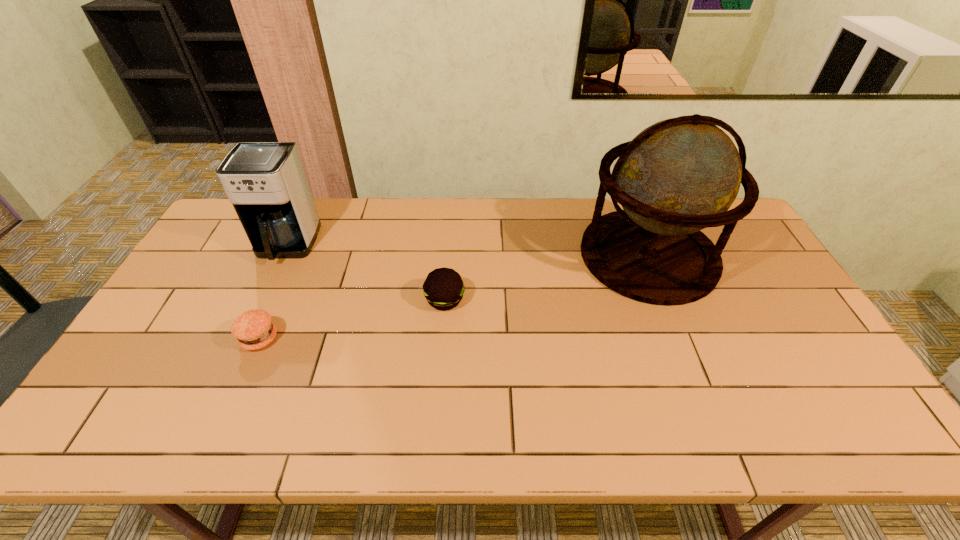
Where is `globe`? globe is located at coordinates (678, 176).

Image resolution: width=960 pixels, height=540 pixels. What are the coordinates of `the tallest object` in the screenshot? It's located at (678, 176).

This screenshot has height=540, width=960. I want to click on coffee maker, so click(266, 182).

Locate an element on the screen. Image resolution: width=960 pixels, height=540 pixels. the farther patty is located at coordinates (443, 288).

This screenshot has width=960, height=540. Identify the location of the taller patty. (443, 288).

The height and width of the screenshot is (540, 960). I want to click on the left patty, so click(254, 329).

Locate an element on the screen. the shortest object is located at coordinates [x=254, y=329].

The width and height of the screenshot is (960, 540). Find the location of `vacant space located 0.170m on the front-facing side of the globe`. vacant space located 0.170m on the front-facing side of the globe is located at coordinates (528, 256).

This screenshot has width=960, height=540. In order to click on vacant position located 0.200m on the front-facing side of the globe in this screenshot , I will do `click(518, 256)`.

Locate an element on the screen. blank area located 0.060m on the front-facing side of the globe is located at coordinates (563, 256).